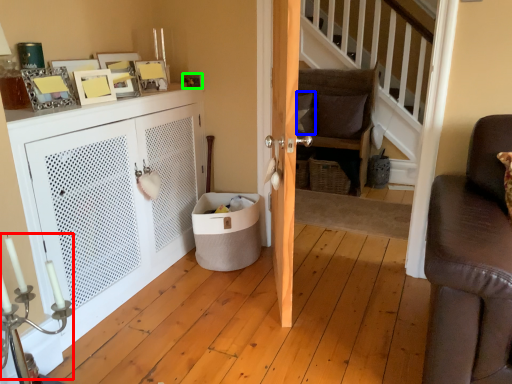
Question: Considering the real-world distances, which object is closest to candle holder (highlighted by a red box)? pillow (highlighted by a blue box) or picture frame (highlighted by a green box).

Choices:
 (A) pillow
 (B) picture frame

Answer: (B)